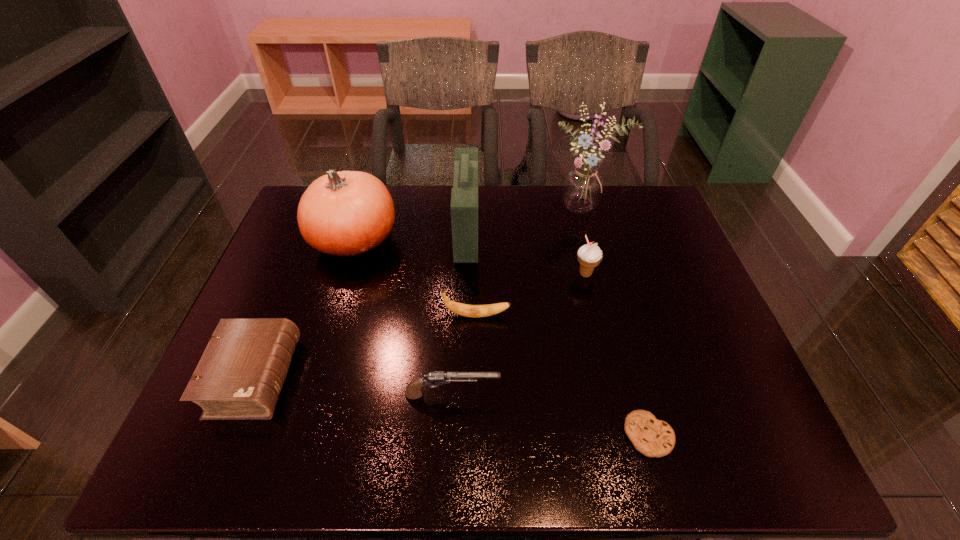
Image resolution: width=960 pixels, height=540 pixels. What are the coordinates of `vacant area that lies between the banana and the fourth tallest object` in the screenshot? It's located at (531, 295).

This screenshot has width=960, height=540. In order to click on vacant area that lies between the banana and the shortest object in this screenshot , I will do `click(563, 375)`.

Identify the location of vacant region between the cookie and the fourth nearest object. (563, 375).

I want to click on free space between the bouquet and the gun, so click(518, 302).

The image size is (960, 540). Identify the location of free spot between the Bible and the gun. (353, 386).

This screenshot has height=540, width=960. In order to click on empty space between the bouquet and the banana in this screenshot , I will do `click(531, 262)`.

You are a GUI agent. You are given a task and a screenshot of the screen. Output one action in this format:
    pyautogui.click(x=<x>, y=<y>)
    Task: Click on the unoccupied position between the cookie and the gun
    Image resolution: width=960 pixels, height=540 pixels.
    Given the screenshot: What is the action you would take?
    pyautogui.click(x=550, y=415)

Where is `free space between the bouquet and the Bible`? This screenshot has width=960, height=540. free space between the bouquet and the Bible is located at coordinates (420, 293).

Identify the location of object that is the seventh closest one to the first-aid kit. The height and width of the screenshot is (540, 960). (653, 438).

You are a GUI agent. You are given a task and a screenshot of the screen. Output one action in this format:
    pyautogui.click(x=<x>, y=<y>)
    Task: Click on the object identified as the fourth closest to the icecream
    
    Given the screenshot: What is the action you would take?
    coord(653,438)